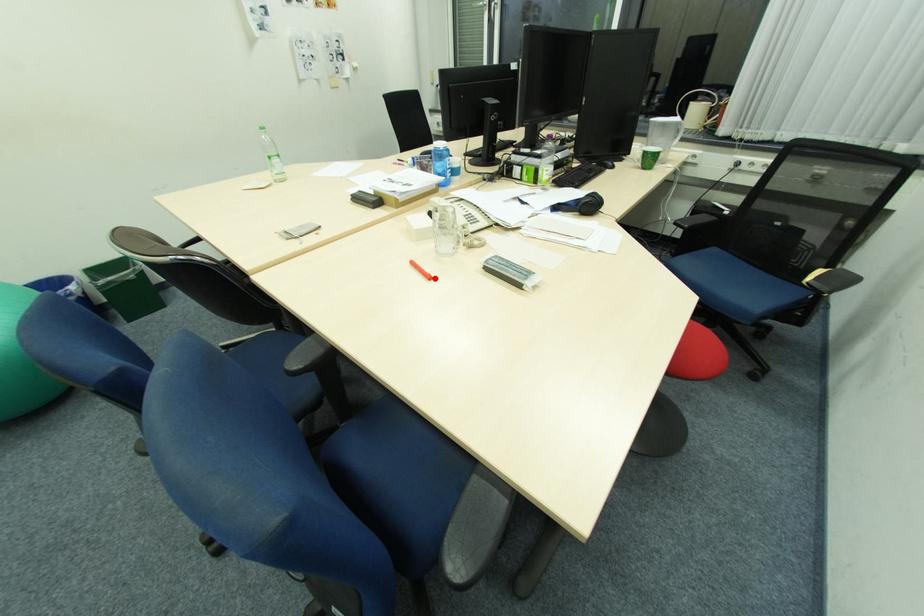
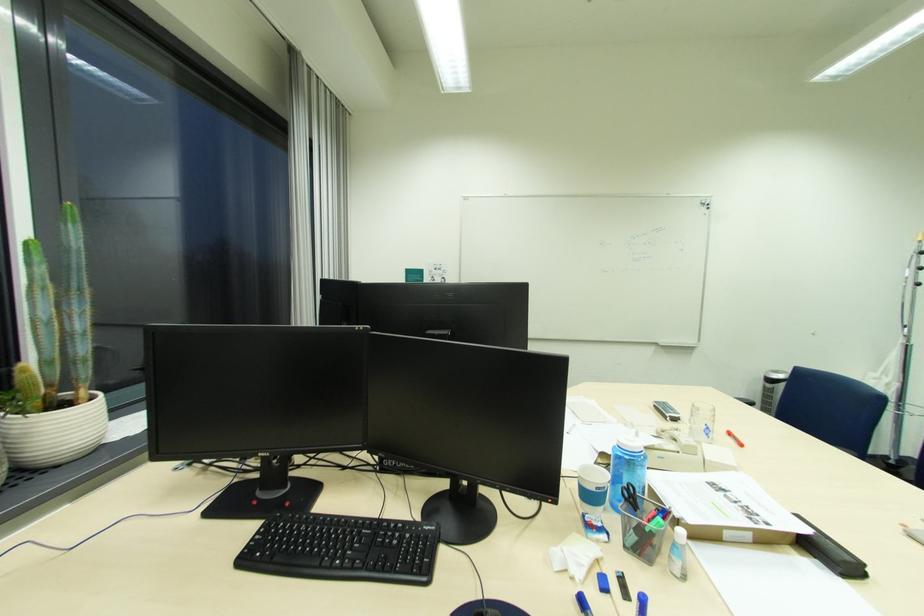
The point at the highlighted location is marked in the first image. Where is the corresponding point in the second image?

(736, 435)